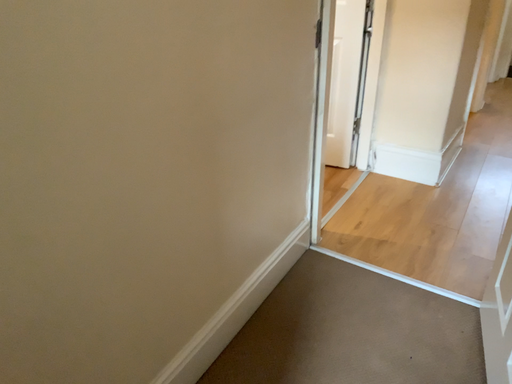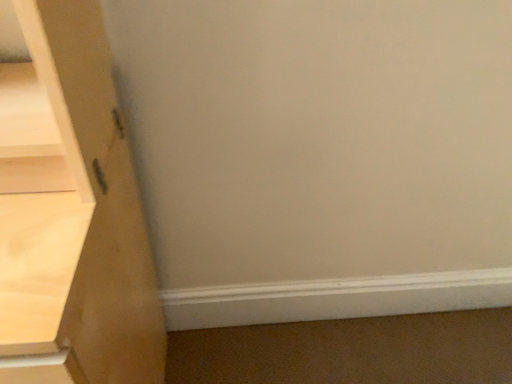
Question: How did the camera likely rotate when shooting the video?

Choices:
 (A) rotated right
 (B) rotated left

Answer: (B)